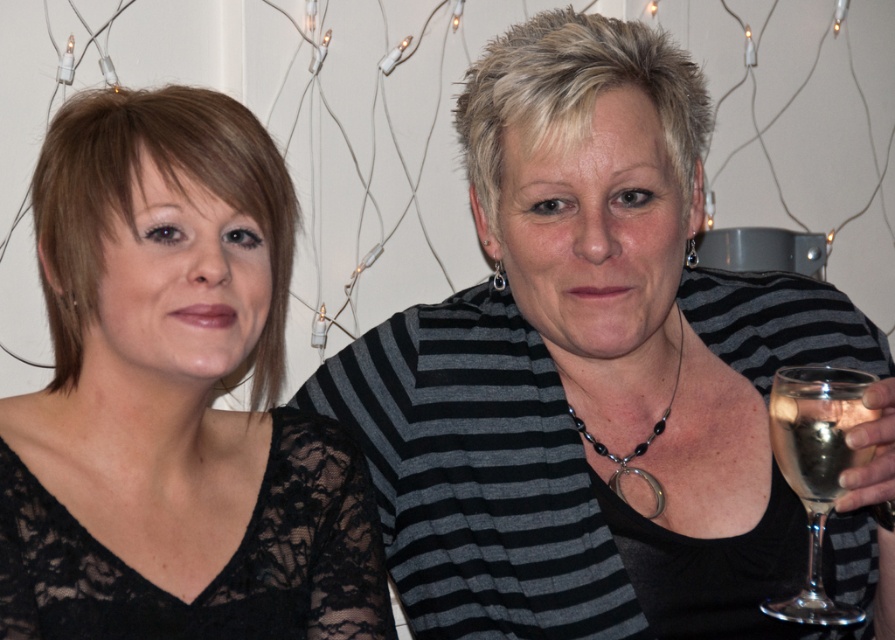
Question: Which of the following is the farthest from the observer?

Choices:
 (A) (644, 513)
 (B) (793, 474)
 (C) (125, 358)
 (D) (788, 445)

Answer: (A)

Question: Is clear glass wine glass at right to the left of black beaded necklace at center from the viewer's perspective?

Choices:
 (A) no
 (B) yes

Answer: (A)

Question: Which object is farther from the camera taking this photo?

Choices:
 (A) clear glass wine glass at right
 (B) black lace top at upper right
 (C) clear glass at right
 (D) black beaded necklace at center

Answer: (D)

Question: Does black lace top at upper right have a smaller size compared to black lace dress at left?

Choices:
 (A) no
 (B) yes

Answer: (A)

Question: Does black lace top at upper right have a greater width compared to black lace dress at left?

Choices:
 (A) no
 (B) yes

Answer: (B)

Question: Considering the real-world distances, which object is farthest from the clear glass at right?

Choices:
 (A) black lace dress at left
 (B) black beaded necklace at center
 (C) black lace top at upper right

Answer: (A)